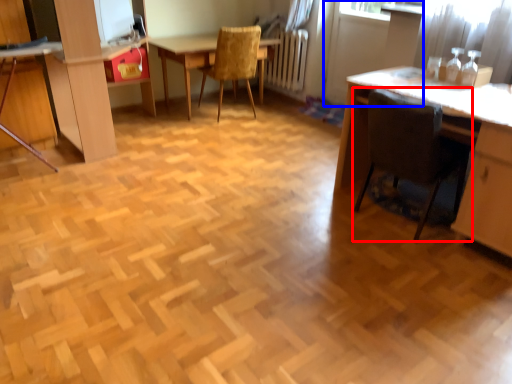
Question: Which of the following is the farthest to the observer, chair (highlighted by a red box) or screen door (highlighted by a blue box)?

Choices:
 (A) chair
 (B) screen door

Answer: (B)